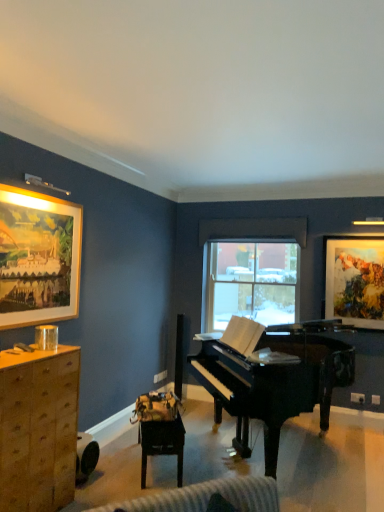
This screenshot has height=512, width=384. I want to click on blank space to the left of wooden table at center, so click(x=118, y=460).